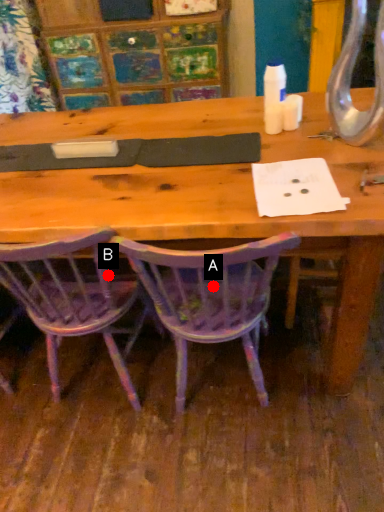
Question: Two points are circled on the image, labeled by A and B beside each circle. Which point is farther from the camera taking this photo?

Choices:
 (A) A is further
 (B) B is further

Answer: (B)